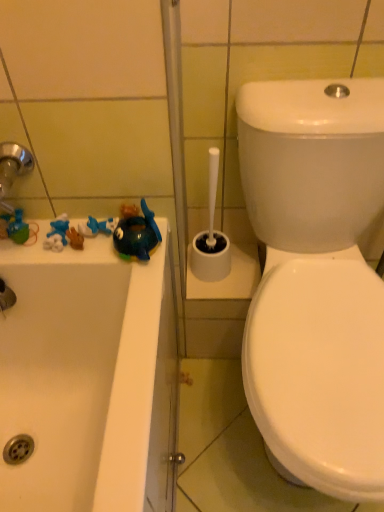
Question: Does matte green toy at left, acting as the first toy starting from the left, have a lesser width compared to blue rubber toy at left, which is the 2th toy in right-to-left order?

Choices:
 (A) no
 (B) yes

Answer: (A)

Question: Considering the relative positions of matte green toy at left, the third toy viewed from the right, and blue rubber toy at left, the second toy positioned from the left, in the image provided, is matte green toy at left, the third toy viewed from the right, behind blue rubber toy at left, the second toy positioned from the left,?

Choices:
 (A) yes
 (B) no

Answer: (A)

Question: Is matte green toy at left, the third toy viewed from the right, in front of blue rubber toy at left, the second toy positioned from the left?

Choices:
 (A) no
 (B) yes

Answer: (A)

Question: Does matte green toy at left, acting as the first toy starting from the left, have a lesser height compared to blue rubber toy at left, the second toy positioned from the left?

Choices:
 (A) yes
 (B) no

Answer: (B)

Question: Does matte green toy at left, acting as the first toy starting from the left, have a greater height compared to blue rubber toy at left, the second toy positioned from the left?

Choices:
 (A) yes
 (B) no

Answer: (A)

Question: Does matte green toy at left, acting as the first toy starting from the left, have a greater width compared to blue rubber toy at left, the second toy positioned from the left?

Choices:
 (A) yes
 (B) no

Answer: (A)

Question: From a real-world perspective, is blue rubber toy at left, which is the 2th toy in right-to-left order, beneath glossy plastic toy at left, acting as the third toy starting from the left?

Choices:
 (A) no
 (B) yes

Answer: (B)

Question: Considering the relative sizes of blue rubber toy at left, the second toy positioned from the left, and glossy plastic toy at left, the 1th toy from the right, in the image provided, is blue rubber toy at left, the second toy positioned from the left, thinner than glossy plastic toy at left, the 1th toy from the right,?

Choices:
 (A) no
 (B) yes

Answer: (B)

Question: Can you confirm if blue rubber toy at left, which is the 2th toy in right-to-left order, is wider than glossy plastic toy at left, acting as the third toy starting from the left?

Choices:
 (A) no
 (B) yes

Answer: (A)

Question: Is blue rubber toy at left, which is the 2th toy in right-to-left order, shorter than glossy plastic toy at left, the 1th toy from the right?

Choices:
 (A) yes
 (B) no

Answer: (A)

Question: Considering the relative positions of blue rubber toy at left, which is the 2th toy in right-to-left order, and glossy plastic toy at left, acting as the third toy starting from the left, in the image provided, is blue rubber toy at left, which is the 2th toy in right-to-left order, to the left of glossy plastic toy at left, acting as the third toy starting from the left, from the viewer's perspective?

Choices:
 (A) no
 (B) yes

Answer: (B)

Question: Would you say blue rubber toy at left, which is the 2th toy in right-to-left order, is outside glossy plastic toy at left, acting as the third toy starting from the left?

Choices:
 (A) no
 (B) yes

Answer: (B)

Question: Considering the relative sizes of matte green toy at left, the third toy viewed from the right, and glossy plastic toy at left, acting as the third toy starting from the left, in the image provided, is matte green toy at left, the third toy viewed from the right, taller than glossy plastic toy at left, acting as the third toy starting from the left,?

Choices:
 (A) yes
 (B) no

Answer: (B)